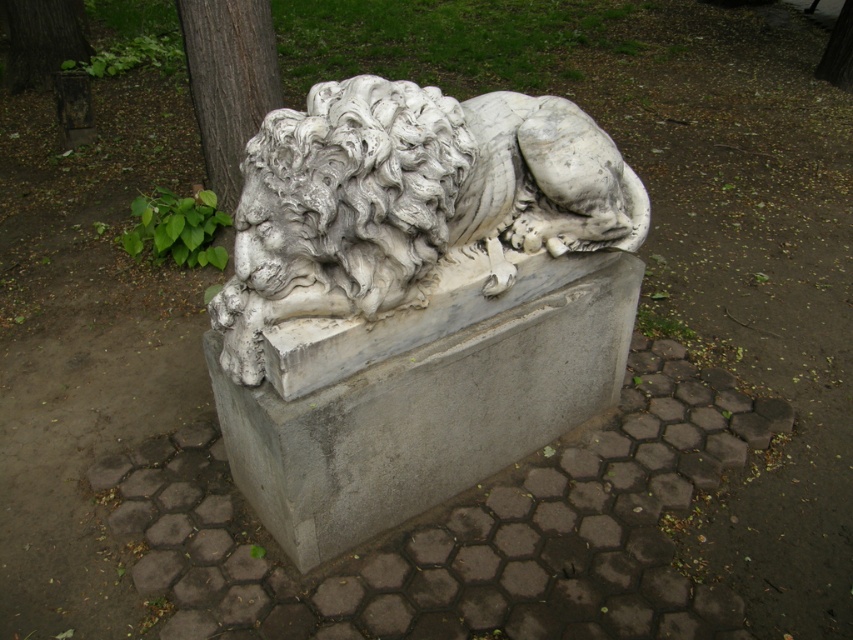
Question: Which point appears closest to the camera in this image?

Choices:
 (A) (564, 429)
 (B) (387, 161)

Answer: (B)

Question: Can you confirm if gray concrete at center is positioned below smooth bark tree at upper left?

Choices:
 (A) yes
 (B) no

Answer: (A)

Question: Is gray concrete at center smaller than white marble lion head at center?

Choices:
 (A) yes
 (B) no

Answer: (B)

Question: Which point is closer to the camera taking this photo?

Choices:
 (A) (415, 225)
 (B) (262, 163)

Answer: (A)

Question: Is white marble lion at center above smooth bark tree at upper left?

Choices:
 (A) yes
 (B) no

Answer: (B)

Question: Which point is closer to the camera?

Choices:
 (A) white marble lion head at center
 (B) gray concrete at center
 (C) white marble lion at center

Answer: (A)